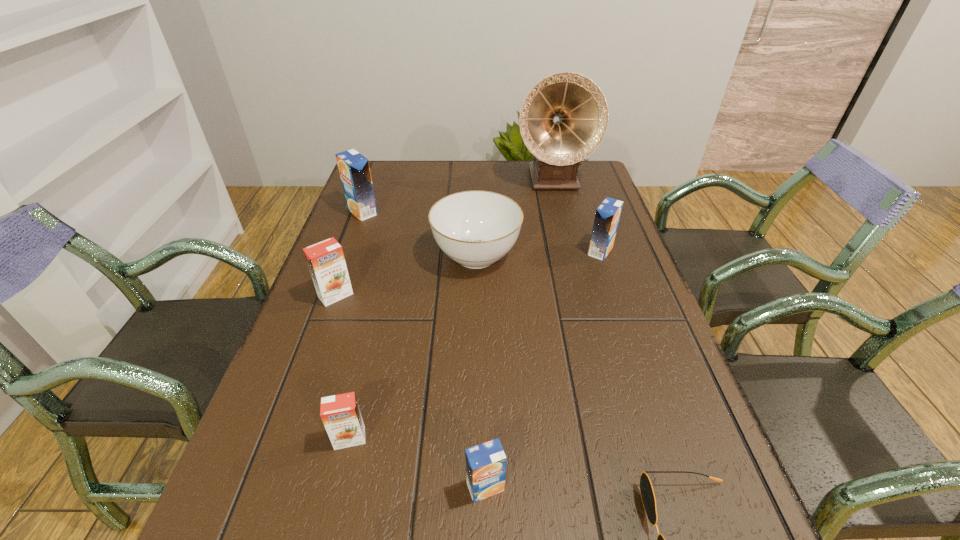
I want to click on phonograph record, so click(563, 119).

The height and width of the screenshot is (540, 960). Identify the location of brown phonograph record. (563, 119).

Where is `the biggest blue orange_juice`? The width and height of the screenshot is (960, 540). the biggest blue orange_juice is located at coordinates (354, 170).

In order to click on the farthest blue orange_juice in this screenshot , I will do `click(354, 170)`.

Find the location of `the bigger orange orange juice`. the bigger orange orange juice is located at coordinates (325, 259).

Identify the location of the left orange orange juice. The height and width of the screenshot is (540, 960). (325, 259).

Where is `the rightmost orange_juice`? This screenshot has width=960, height=540. the rightmost orange_juice is located at coordinates (607, 216).

This screenshot has width=960, height=540. Identify the location of the rightmost blue orange_juice. (607, 216).

Where is `gray chinaware`? The height and width of the screenshot is (540, 960). gray chinaware is located at coordinates (474, 228).

Where is `the sixth farthest object`? The height and width of the screenshot is (540, 960). the sixth farthest object is located at coordinates (340, 414).